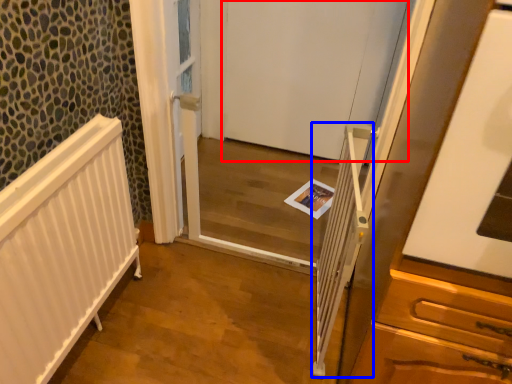
Question: Which object appears farthest to the camera in this image, door (highlighted by a red box) or balustrade (highlighted by a blue box)?

Choices:
 (A) door
 (B) balustrade

Answer: (A)